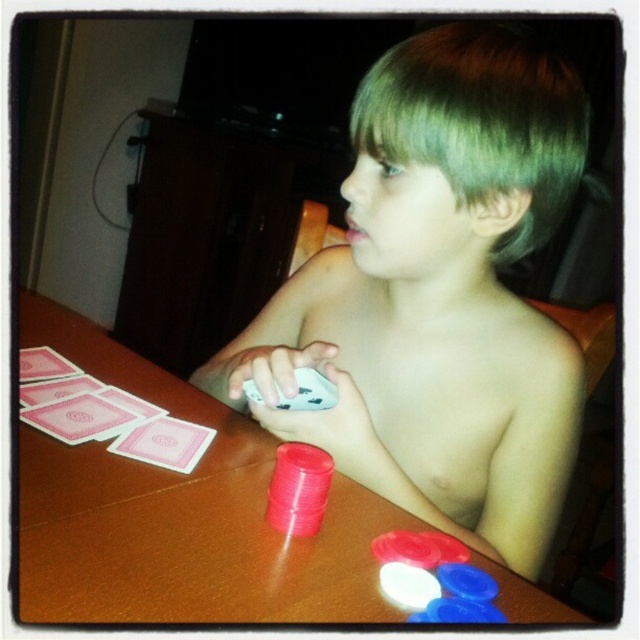
Find the location of `brown wooden table at center`. brown wooden table at center is located at coordinates tap(177, 515).

Who is higher up, brown wooden table at center or pink paper cards at left?

pink paper cards at left is higher up.

The width and height of the screenshot is (640, 640). Find the location of `brown wooden table at center`. brown wooden table at center is located at coordinates (177, 515).

Where is `brown wooden table at center`? The height and width of the screenshot is (640, 640). brown wooden table at center is located at coordinates (177, 515).

Between pink paper cards at left and smooth plastic poker chips at center, which one has more height?

With more height is pink paper cards at left.

Which is in front, point (97, 424) or point (323, 506)?

Point (323, 506)

Who is more forward, (x=81, y=410) or (x=273, y=500)?

Point (x=273, y=500) is in front.

Identify the location of pink paper cards at left. (104, 413).

Is green matte hair at upper center closer to the viewer compared to smooth plastic poker chips at center?

No, it is not.

Which is behind, point (465, 112) or point (314, 451)?

Positioned behind is point (314, 451).

Locate an element on the screen. green matte hair at upper center is located at coordinates (481, 120).